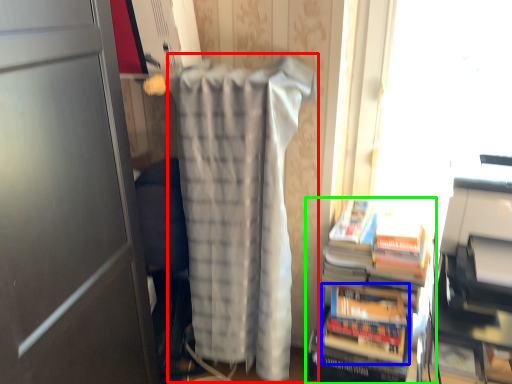
Question: Estimate the real-world distances between objects in this image. Which object is closer to blanket (highlighted by a red box), paperback book (highlighted by a blue box) or book (highlighted by a green box)?

Choices:
 (A) paperback book
 (B) book

Answer: (B)